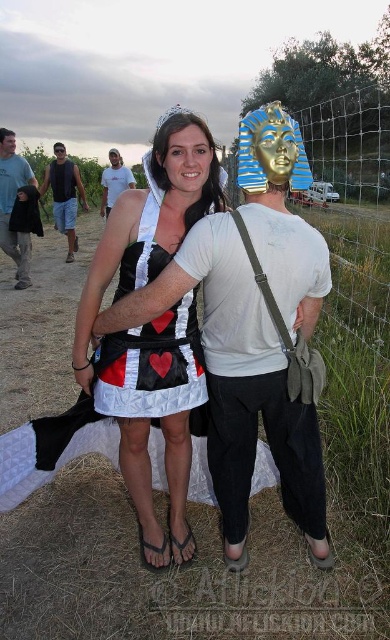
Question: Can you confirm if quilted fabric dress at center is positioned below matte white t-shirt at center?

Choices:
 (A) yes
 (B) no

Answer: (A)

Question: Which object is positioned farthest from the matte black tank top at left?

Choices:
 (A) matte white t-shirt at center
 (B) quilted fabric dress at center
 (C) brushed metal water at bottle left

Answer: (B)

Question: Which point appears farthest from the camera in this image?

Choices:
 (A) coord(117,148)
 (B) coord(248,323)

Answer: (A)

Question: Is quilted fabric dress at center bigger than brushed metal water at bottle left?

Choices:
 (A) yes
 (B) no

Answer: (A)

Question: Which is nearer to the brushed metal water at bottle left?

Choices:
 (A) matte white t-shirt at center
 (B) quilted fabric dress at center
 (C) matte black tank top at left

Answer: (C)

Question: Is matte black tank top at left further to the viewer compared to matte white t-shirt at center?

Choices:
 (A) no
 (B) yes

Answer: (B)